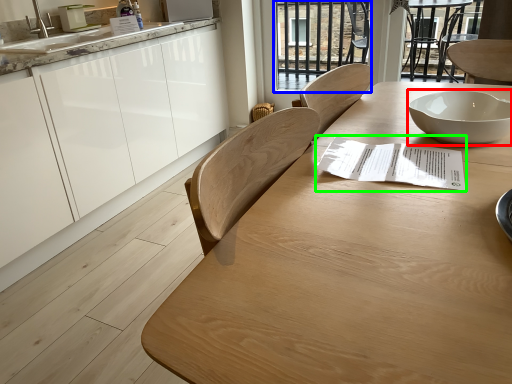
Question: Estimate the real-world distances between objects in this image. Which object is closer to bowl (highlighted by a red box), glass door (highlighted by a blue box) or paper (highlighted by a green box)?

Choices:
 (A) glass door
 (B) paper

Answer: (B)